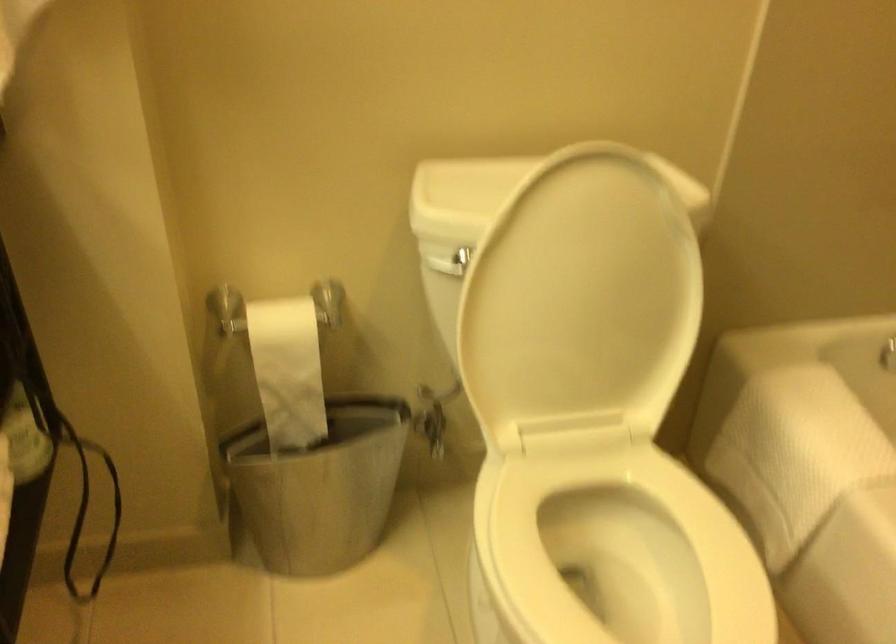
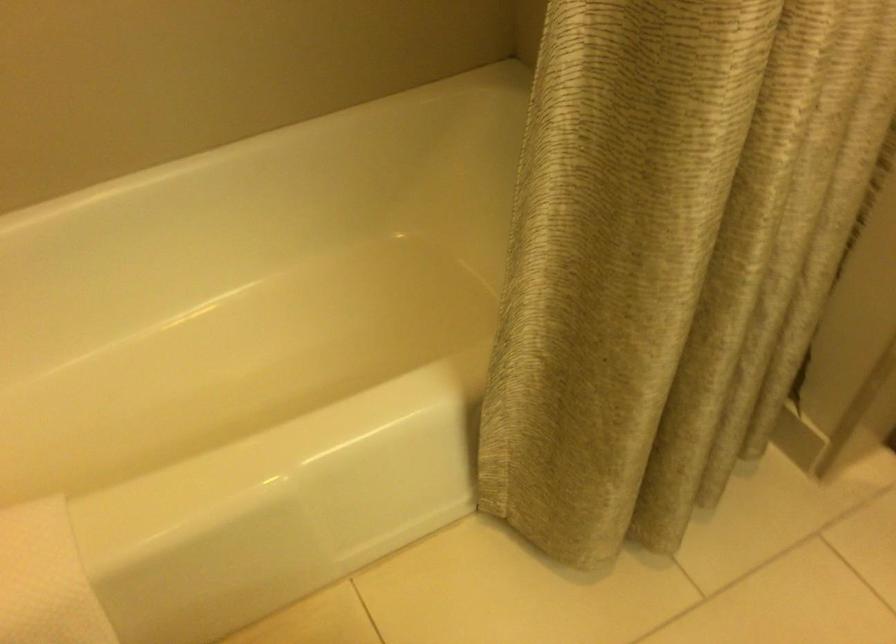
The images are taken continuously from a first-person perspective. In which direction is your viewpoint rotating?

The camera's rotation is toward right-down.